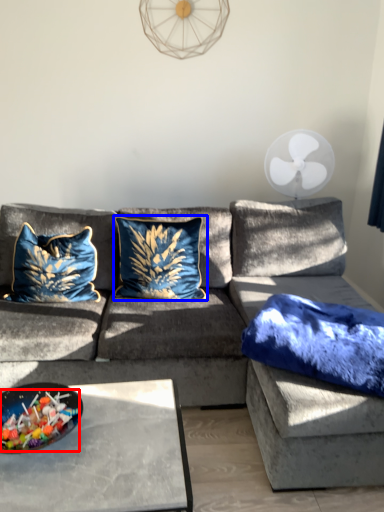
Question: Which of the following is the farthest to the observer, food (highlighted by a red box) or pillow (highlighted by a blue box)?

Choices:
 (A) food
 (B) pillow

Answer: (B)